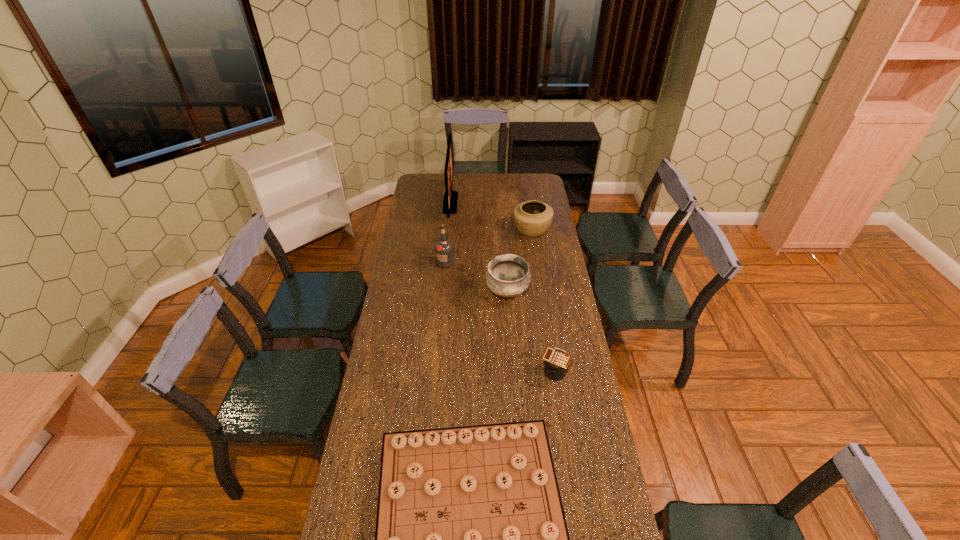
Locate an element on the screen. vacant space in between the second nearest object and the fifth shortest object is located at coordinates (499, 316).

The width and height of the screenshot is (960, 540). Find the location of `free space between the calculator and the vodka`. free space between the calculator and the vodka is located at coordinates (499, 316).

Find the location of a particular element. The height and width of the screenshot is (540, 960). vacant area between the calculator and the fourth farthest object is located at coordinates (531, 331).

Identify which object is the fifth closest to the tallest object. Please provide its 2D coordinates. Your answer should be formatted as a tuple, i.e. [(x, y)], where the tuple contains the x and y coordinates of a point satisfying the conditions above.

[(471, 539)]

Find the location of a particular element. The height and width of the screenshot is (540, 960). object that is the second closest to the nearer pottery is located at coordinates (556, 360).

This screenshot has height=540, width=960. In order to click on free point that satisfies the following two spatial constraints: 1. on the front label of the second tallest object; 2. on the right side of the second nearest object in this screenshot , I will do `click(435, 370)`.

Where is `vacant space that satisfies the following two spatial constraints: 1. on the front-facing side of the calculator; 2. on the left side of the tallest object`? Image resolution: width=960 pixels, height=540 pixels. vacant space that satisfies the following two spatial constraints: 1. on the front-facing side of the calculator; 2. on the left side of the tallest object is located at coordinates [x=435, y=370].

I want to click on vacant space that satisfies the following two spatial constraints: 1. on the front label of the vodka; 2. on the right side of the nearer pottery, so click(443, 292).

The height and width of the screenshot is (540, 960). I want to click on blank area in the image that satisfies the following two spatial constraints: 1. on the front label of the third farthest object; 2. on the right side of the fourth farthest object, so click(443, 292).

The image size is (960, 540). Identify the location of free space that satisfies the following two spatial constraints: 1. on the front label of the vodka; 2. on the left side of the fifth farthest object. click(435, 370).